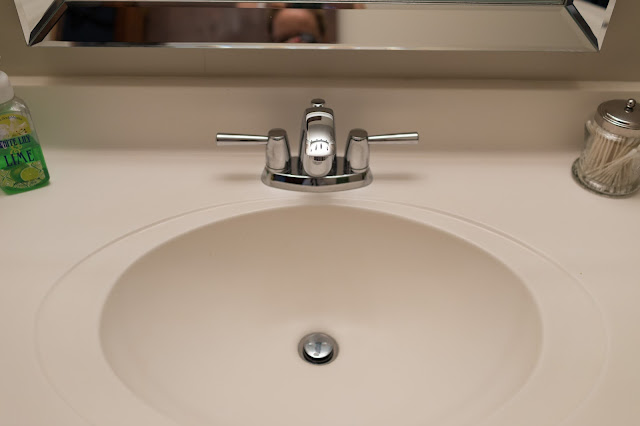
Identify the location of q-tips. The height and width of the screenshot is (426, 640). (607, 169).